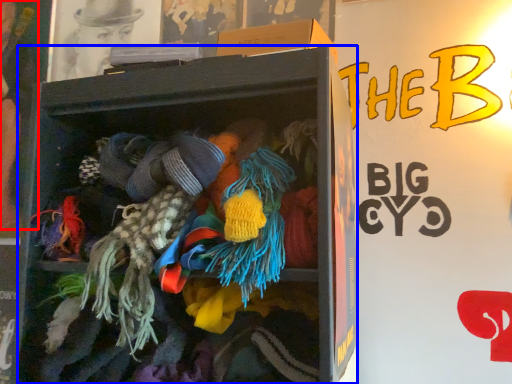
Question: Which object is closer to the camera taking this photo, person (highlighted by a red box) or shelf (highlighted by a blue box)?

Choices:
 (A) person
 (B) shelf

Answer: (B)